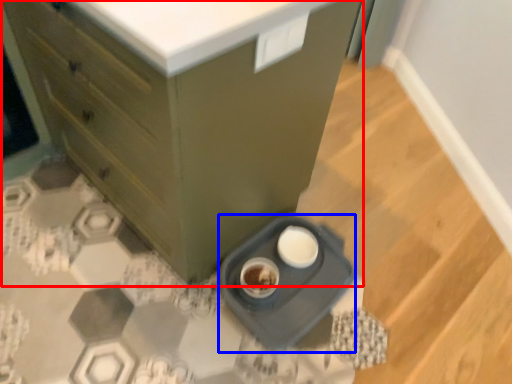
Question: Among these objects, which one is farthest to the camera, chest of drawers (highlighted by a red box) or appliance (highlighted by a blue box)?

Choices:
 (A) chest of drawers
 (B) appliance

Answer: (B)